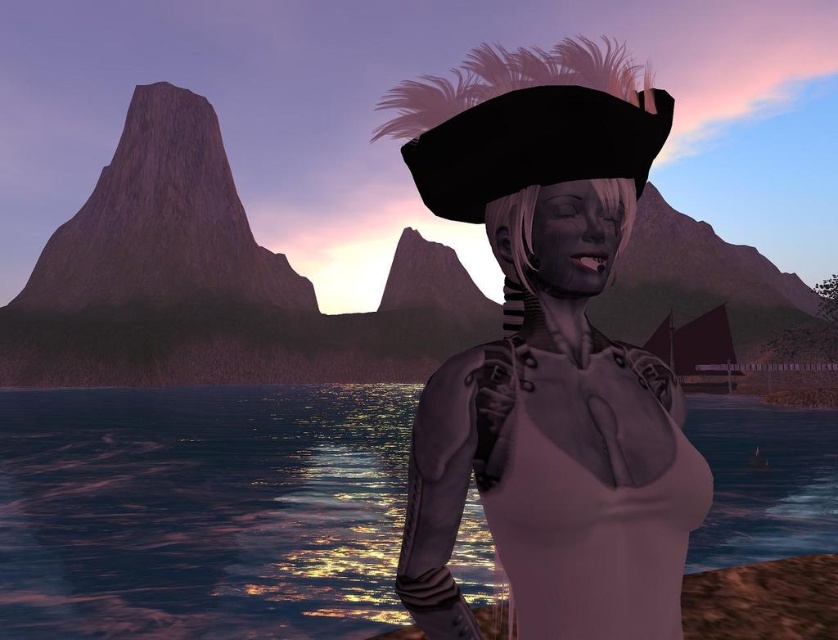
You are a fashion designer who wants to create a hat similar to the matte black pirate hat at center. To ensure the scale is correct, you need to know the size of the hat compared to the glistening water at center. Which one is larger?

The glistening water at center is bigger than the matte black pirate hat at center, so the water is larger. Therefore, the matte black pirate hat at center would need to be scaled down to match the proportions shown in the image.

Looking at this image, you are a photographer planning to capture a portrait of the character wearing the satin pink dress at center while ensuring the glistening water at center is visible in the background. Given the distance between them, can you position yourself in a way that both elements are in focus simultaneously?

The glistening water at center and satin pink dress at center are 18.34 meters apart. To have both in focus, ensure your camera has a sufficient depth of field by using a small aperture setting. This allows sharpness from the foreground dress to the distant water.

In the scene shown: You are a fashion designer observing the scene. You need to determine which item is taller between the matte black pirate hat at center and the satin pink dress at center. Which one is taller?

The matte black pirate hat at center is taller than the satin pink dress at center according to the description.